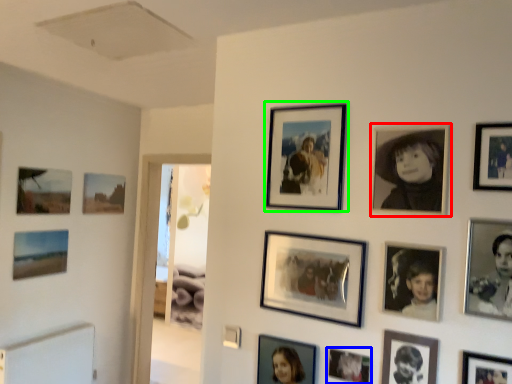
Question: Which object is the closest to the picture frame (highlighted by a red box)? Choose among these: picture frame (highlighted by a blue box) or picture frame (highlighted by a green box).

Choices:
 (A) picture frame
 (B) picture frame

Answer: (B)